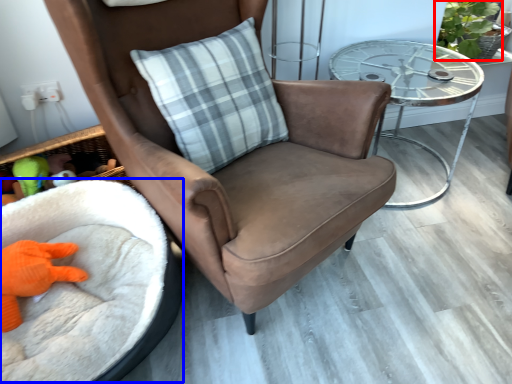
Question: Which point is further to the camera, plant (highlighted by a red box) or infant bed (highlighted by a blue box)?

Choices:
 (A) plant
 (B) infant bed

Answer: (A)